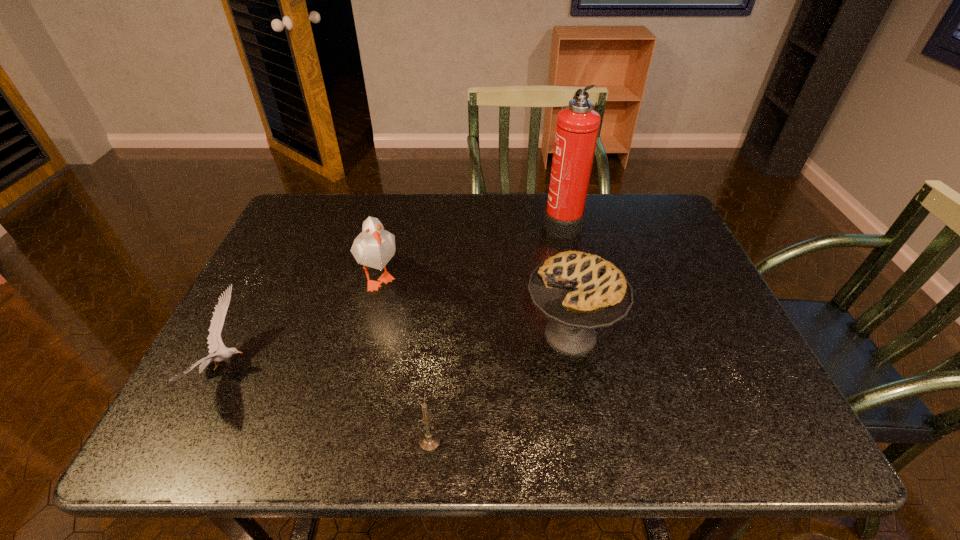
Where is `blank space located on the front-facing side of the fire extinguisher`? The width and height of the screenshot is (960, 540). blank space located on the front-facing side of the fire extinguisher is located at coordinates (419, 222).

The image size is (960, 540). In order to click on vacant area situated 0.370m on the front-facing side of the fire extinguisher in this screenshot , I will do `click(419, 222)`.

Where is `vacant area located at the beak of the right gull`? vacant area located at the beak of the right gull is located at coordinates (355, 373).

Image resolution: width=960 pixels, height=540 pixels. I want to click on vacant area situated 0.320m on the cut side of the third tallest object, so click(384, 335).

Locate an element on the screen. This screenshot has width=960, height=540. free space located on the cut side of the third tallest object is located at coordinates (475, 335).

This screenshot has height=540, width=960. I want to click on vacant space located 0.130m on the cut side of the third tallest object, so click(x=467, y=335).

You are a GUI agent. You are given a task and a screenshot of the screen. Output one action in this format:
    pyautogui.click(x=<x>, y=<y>)
    Task: Click on the free point located at the tip of the beak of the shorter gull
    Image resolution: width=960 pixels, height=540 pixels.
    Given the screenshot: What is the action you would take?
    pyautogui.click(x=377, y=368)

The width and height of the screenshot is (960, 540). What are the coordinates of `free space located on the right of the candle` in the screenshot? It's located at (504, 442).

Where is `object that is positioned at the far edge`? This screenshot has height=540, width=960. object that is positioned at the far edge is located at coordinates (577, 128).

Find the location of a particular element. gull located at the near edge is located at coordinates (214, 339).